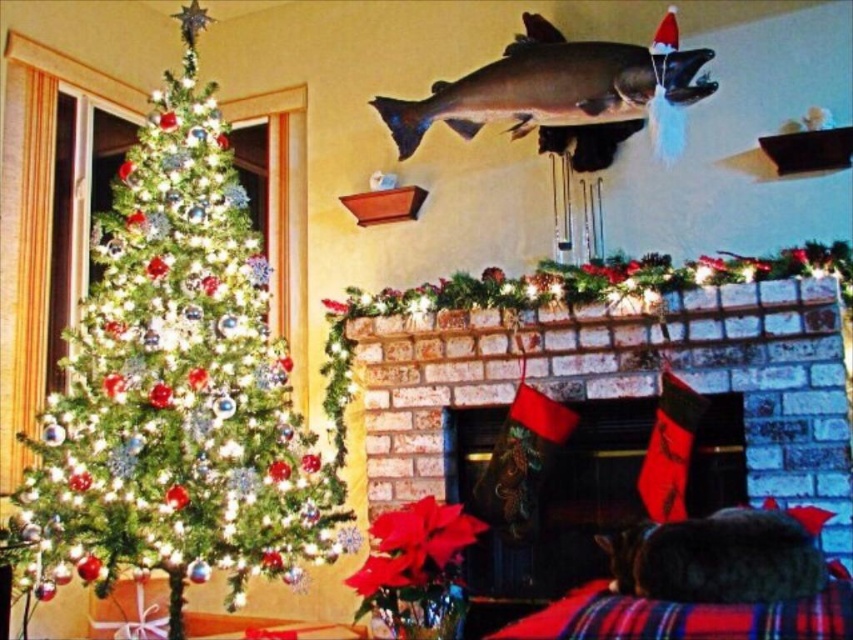
Which of these two, green matte christmas tree at left or brick fireplace at center, stands taller?

Standing taller between the two is green matte christmas tree at left.

Does green matte christmas tree at left appear over brick fireplace at center?

Yes, green matte christmas tree at left is above brick fireplace at center.

Where is `green matte christmas tree at left`? This screenshot has width=853, height=640. green matte christmas tree at left is located at coordinates (177, 385).

Image resolution: width=853 pixels, height=640 pixels. Find the location of `green matte christmas tree at left`. green matte christmas tree at left is located at coordinates pos(177,385).

This screenshot has width=853, height=640. What do you see at coordinates (177, 385) in the screenshot?
I see `green matte christmas tree at left` at bounding box center [177, 385].

Who is more forward, (199, 28) or (447, 120)?

Point (447, 120)

Find the location of a particular element. The height and width of the screenshot is (640, 853). green matte christmas tree at left is located at coordinates (177, 385).

Is point (392, 493) positioned behind point (523, 108)?

Yes, point (392, 493) is behind point (523, 108).

What do you see at coordinates (621, 381) in the screenshot? I see `brick fireplace at center` at bounding box center [621, 381].

At what (x,y) coordinates should I click in order to perform the action: click on brick fireplace at center. Please return your answer as a coordinate pair (x, y). Image resolution: width=853 pixels, height=640 pixels. Looking at the image, I should click on (x=621, y=381).

You are a GUI agent. You are given a task and a screenshot of the screen. Output one action in this format:
    pyautogui.click(x=<x>, y=<y>)
    Task: Click on the brick fireplace at center
    
    Given the screenshot: What is the action you would take?
    pyautogui.click(x=621, y=381)